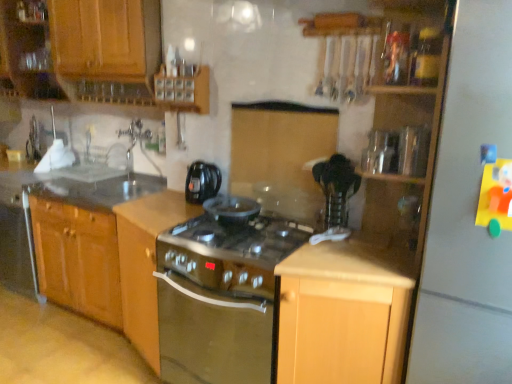
You are a GUI agent. You are given a task and a screenshot of the screen. Output one action in this format:
    pyautogui.click(x=<x>, y=<y>)
    Task: Click on the free area below clear glass sink at upper left (from a real-world perspective)
    The height and width of the screenshot is (384, 512).
    Given the screenshot: What is the action you would take?
    pyautogui.click(x=89, y=175)